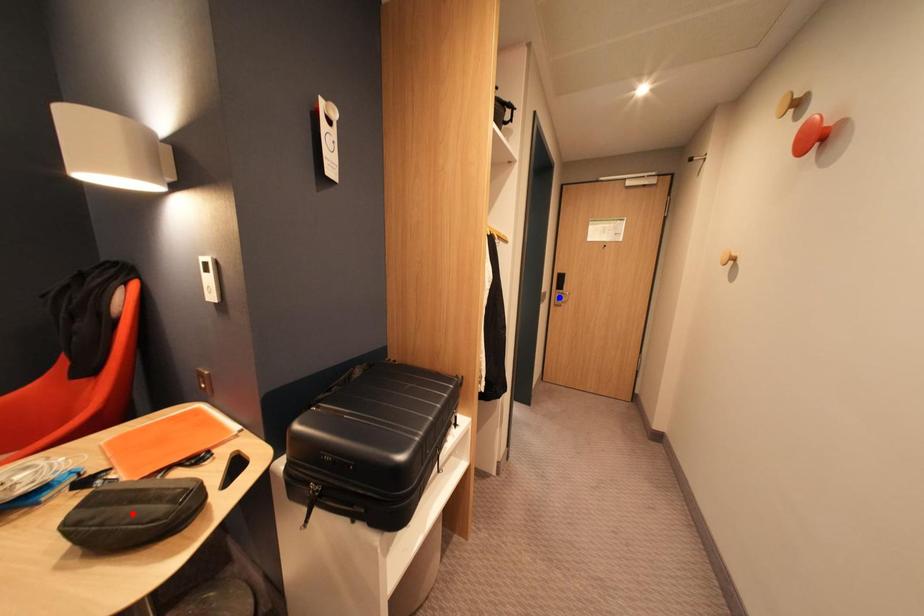
Question: In the image, two points are highlighted. Which point is nearer to the camera? Reply with the corresponding letter.

Choices:
 (A) blue point
 (B) red point

Answer: (B)